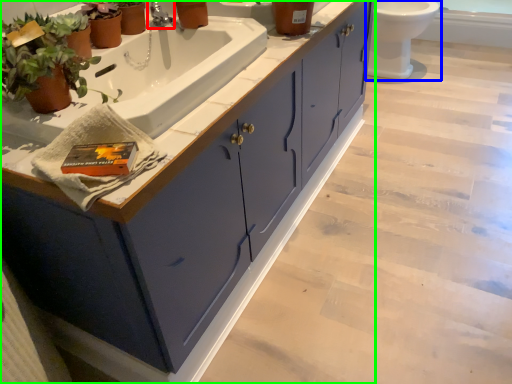
Question: Based on their relative distances, which object is nearer to tap (highlighted by a red box)? Choose from toilet (highlighted by a blue box) and bathroom cabinet (highlighted by a green box).

Choices:
 (A) toilet
 (B) bathroom cabinet

Answer: (B)